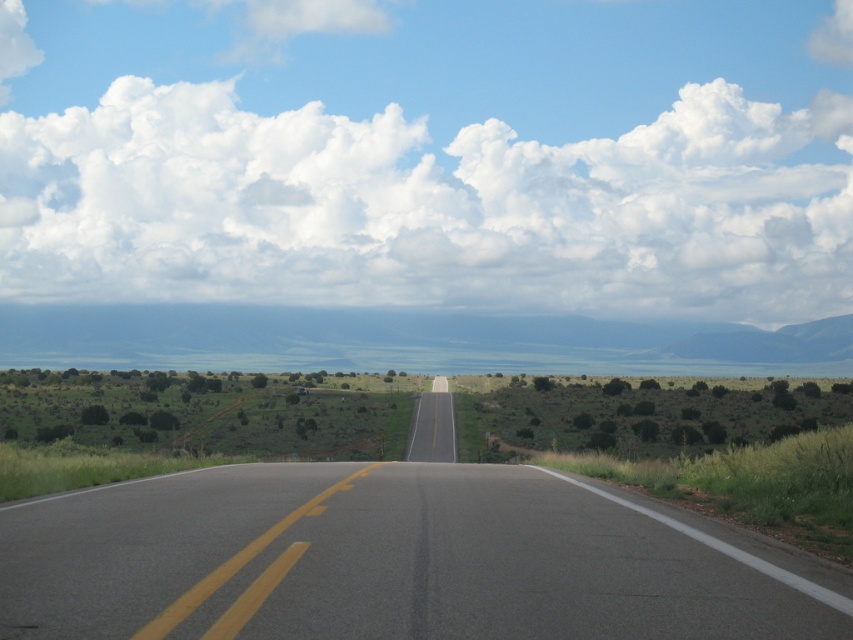
Question: Where is green grassland at center located in relation to green grass at right in the image?

Choices:
 (A) below
 (B) above

Answer: (B)

Question: Which object is closer to the camera taking this photo?

Choices:
 (A) green grassland at center
 (B) asphalt road at center

Answer: (B)

Question: Among these points, which one is nearest to the camera?

Choices:
 (A) (431, 390)
 (B) (625, 477)

Answer: (B)

Question: Can you confirm if green grass at right is positioned to the left of asphalt road at center?

Choices:
 (A) yes
 (B) no

Answer: (B)

Question: Does green grassland at center appear under asphalt road at center?

Choices:
 (A) yes
 (B) no

Answer: (B)

Question: Which of the following is the farthest from the observer?

Choices:
 (A) (752, 497)
 (B) (450, 419)
 (C) (431, 362)

Answer: (C)